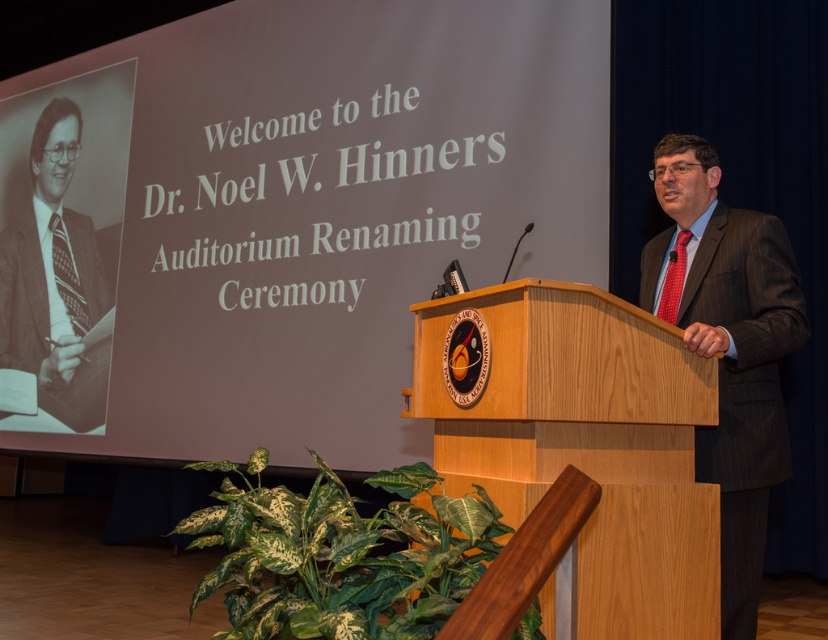
You are attending the renaming ceremony and need to place a NASA emblem sticker on the object that is bigger between the wooden podium at center and the red textured tie at center. Which object should you choose?

The wooden podium at center is larger in size than the red textured tie at center, so you should place the NASA emblem sticker on the wooden podium at center.

You are standing at the entrance of the auditorium and want to take a photo of both point (x=598, y=420) and point (x=6, y=276) in the scene. Which point should you focus on first to ensure both are in clear view?

You should focus on point (x=598, y=420) first because it is closer to the camera than point (x=6, y=276), ensuring both points are in clear view when focused on the closer one.